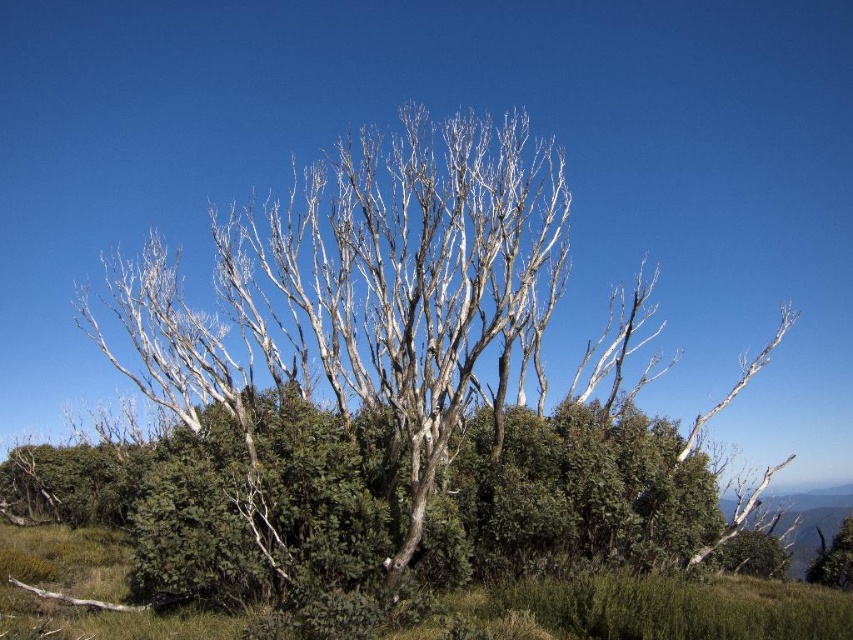
Who is positioned more to the left, white bark tree at center or green matte grass at lower center?

green matte grass at lower center is more to the left.

This screenshot has width=853, height=640. Find the location of `white bark tree at center`. white bark tree at center is located at coordinates (361, 296).

Identify the location of white bark tree at center. (361, 296).